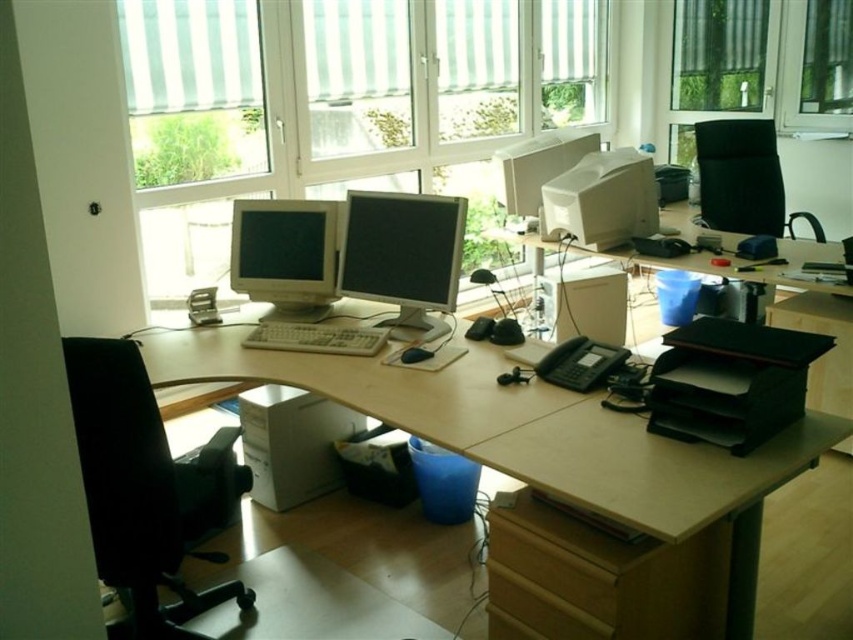
Question: Is white plastic keyboard at center below black matte mouse at center?

Choices:
 (A) no
 (B) yes

Answer: (A)

Question: Does transparent glass window at upper right come behind black plastic printer at right?

Choices:
 (A) yes
 (B) no

Answer: (A)

Question: Is matte black monitor at center further to the viewer compared to black matte mouse at center?

Choices:
 (A) no
 (B) yes

Answer: (B)

Question: Which object is the closest to the wooden drawer at lower center?

Choices:
 (A) matte black monitor at center
 (B) black mesh office chair at upper right

Answer: (A)

Question: Which point is farther to the camera?

Choices:
 (A) (735, 42)
 (B) (425, 358)

Answer: (A)

Question: Which of the following is the closest to the observer?

Choices:
 (A) (686, 349)
 (B) (746, 179)

Answer: (A)